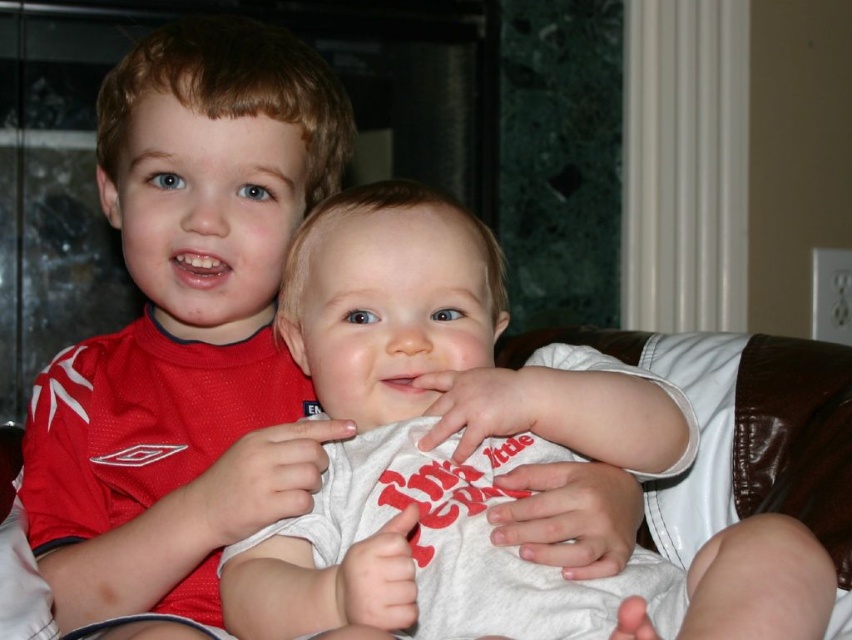
Which is below, white cotton shirt at center or matte red shirt at upper left?

white cotton shirt at center

Is white cotton shirt at center closer to camera compared to matte red shirt at upper left?

Yes.

At what (x,y) coordinates should I click in order to perform the action: click on white cotton shirt at center. Please return your answer as a coordinate pair (x, y). The width and height of the screenshot is (852, 640). Looking at the image, I should click on (478, 458).